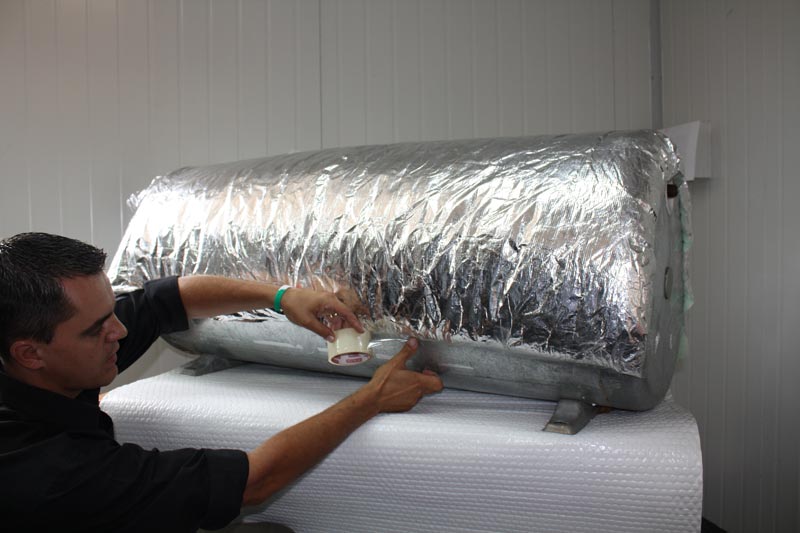
Locate an element on the screen. wall is located at coordinates (360, 102).